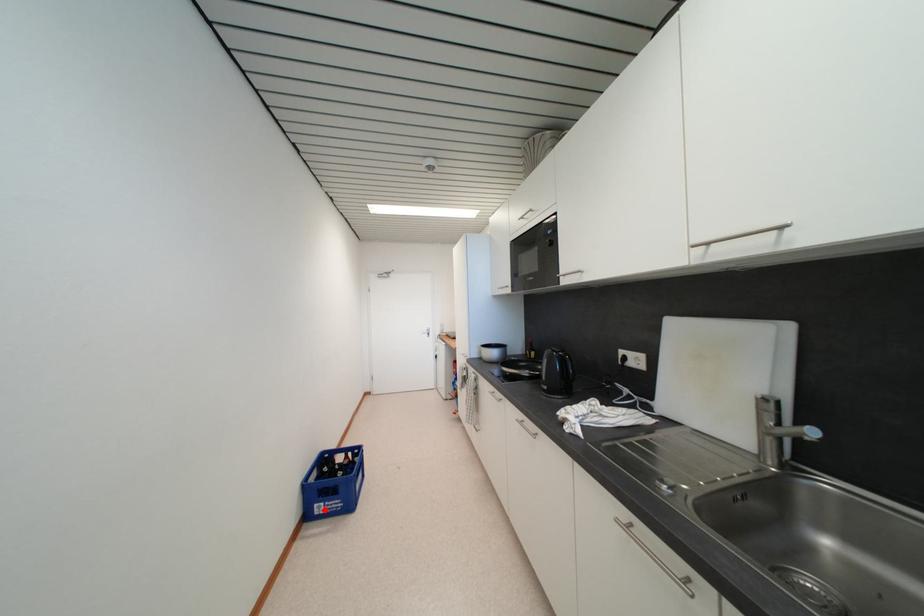
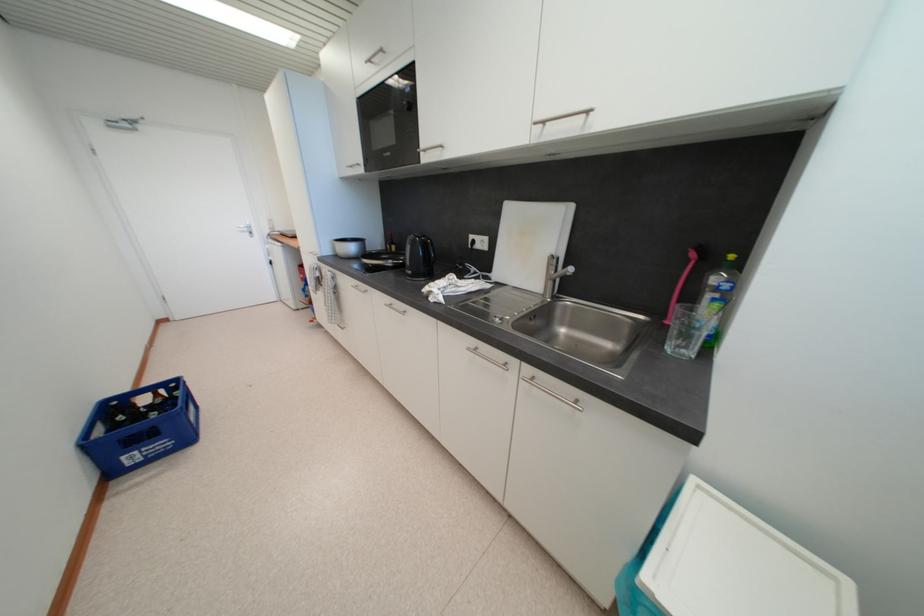
Question: I am providing you with two images of the same scene from different viewpoints. In image1, a red point is highlighted. Considering the same 3D point in image2, which of the following is correct?

Choices:
 (A) It is closer
 (B) It is farther

Answer: (A)